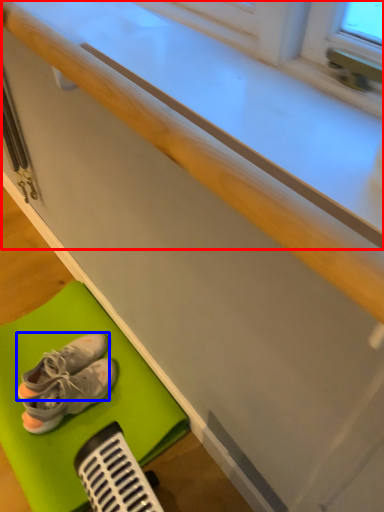
Question: Which point is closer to the camera, counter top (highlighted by a red box) or footwear (highlighted by a blue box)?

Choices:
 (A) counter top
 (B) footwear

Answer: (A)